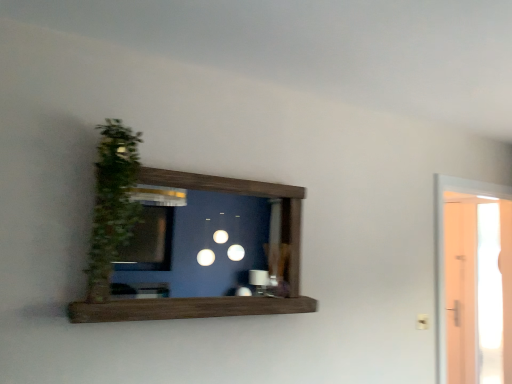
Question: From a real-world perspective, relative to green leafy plant at left, is transparent glass door at right vertically above or below?

Choices:
 (A) above
 (B) below

Answer: (B)

Question: In terms of height, does transparent glass door at right look taller or shorter compared to green leafy plant at left?

Choices:
 (A) short
 (B) tall

Answer: (B)

Question: From the image's perspective, is transparent glass door at right above or below green leafy plant at left?

Choices:
 (A) above
 (B) below

Answer: (B)

Question: In the image, is green leafy plant at left positioned in front of or behind transparent glass door at right?

Choices:
 (A) behind
 (B) front

Answer: (B)

Question: Which is correct: green leafy plant at left is inside transparent glass door at right, or outside of it?

Choices:
 (A) outside
 (B) inside

Answer: (A)

Question: Is point (95, 279) positioned closer to the camera than point (487, 347)?

Choices:
 (A) closer
 (B) farther

Answer: (A)

Question: From a real-world perspective, is green leafy plant at left positioned above or below transparent glass door at right?

Choices:
 (A) below
 (B) above

Answer: (B)